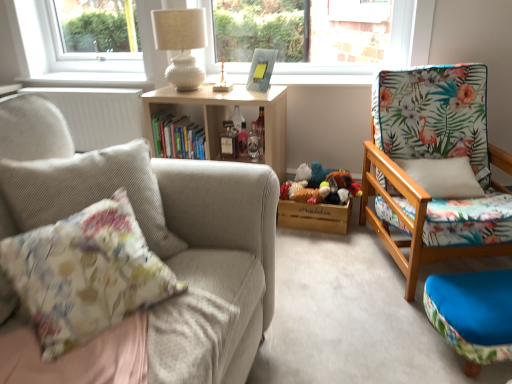
Question: Considering the positions of hardcover books at center and clear glass bottle at center, which is the 3th bottle in left-to-right order, in the image, is hardcover books at center taller or shorter than clear glass bottle at center, which is the 3th bottle in left-to-right order,?

Choices:
 (A) short
 (B) tall

Answer: (B)

Question: From a real-world perspective, is hardcover books at center above or below clear glass bottle at center, which appears as the first bottle when viewed from the right?

Choices:
 (A) above
 (B) below

Answer: (A)

Question: Estimate the real-world distances between objects in this image. Which object is closer to the white ribbed radiator at left?

Choices:
 (A) shiny glass bottle at center, which is the 3th bottle from right to left
 (B) blue fabric ottoman at lower right
 (C) wooden bookshelf at center
 (D) translucent glass figurine at upper center
 (E) clear glass bottle at center, which appears as the first bottle when viewed from the right

Answer: (C)

Question: Considering the real-world distances, which object is farthest from the white ribbed radiator at left?

Choices:
 (A) floral fabric chair at right, which is the 1th chair from back to front
 (B) hardcover books at center
 (C) wooden bookshelf at center
 (D) translucent glass bottle at center, acting as the second bottle starting from the left
 (E) shiny glass bottle at center, which is the 3th bottle from right to left

Answer: (A)